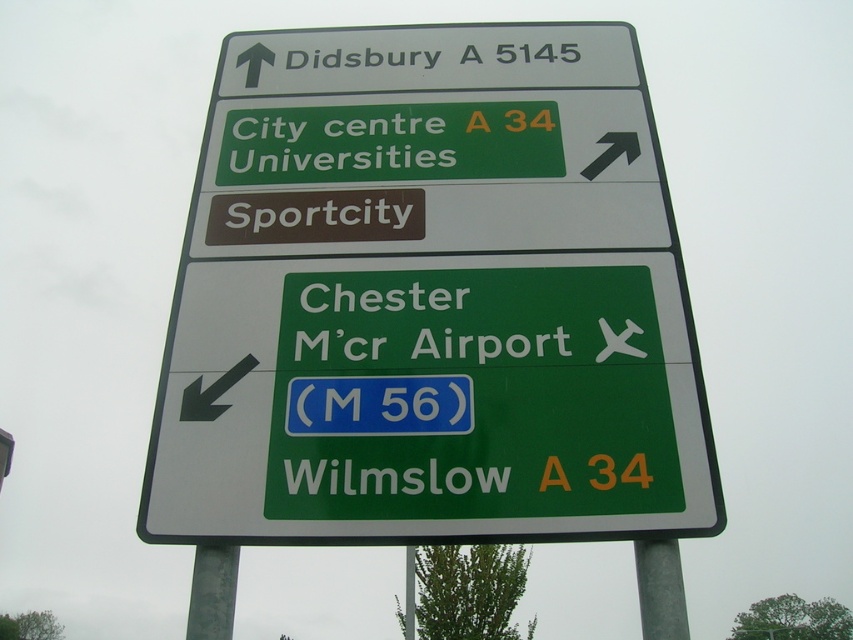
Question: Among these objects, which one is farthest from the camera?

Choices:
 (A) gray metallic pole at lower right
 (B) green plastic sign at upper center

Answer: (A)

Question: Can you confirm if green plastic sign at upper center is thinner than metallic gray pole at lower center?

Choices:
 (A) no
 (B) yes

Answer: (A)

Question: Which point is farther from the camera taking this photo?

Choices:
 (A) (520, 483)
 (B) (662, 636)
 (C) (215, 636)

Answer: (A)

Question: Is gray metallic pole at lower right wider than metallic gray pole at lower center?

Choices:
 (A) no
 (B) yes

Answer: (B)

Question: Can you confirm if green plastic sign at upper center is bigger than gray metallic pole at lower right?

Choices:
 (A) no
 (B) yes

Answer: (B)

Question: Based on their relative distances, which object is farther from the gray metallic pole at lower right?

Choices:
 (A) metallic gray pole at lower center
 (B) green plastic sign at upper center

Answer: (A)